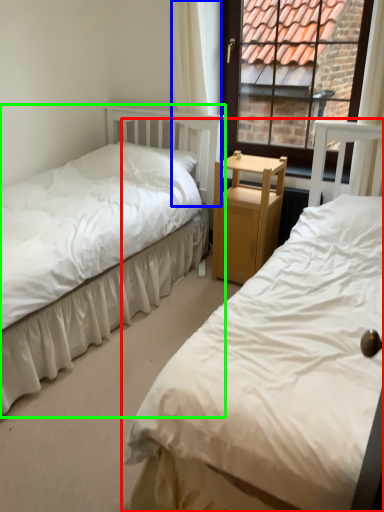
Question: Which object is the farthest from bed (highlighted by a red box)? Choose among these: curtain (highlighted by a blue box) or bed (highlighted by a green box).

Choices:
 (A) curtain
 (B) bed

Answer: (A)